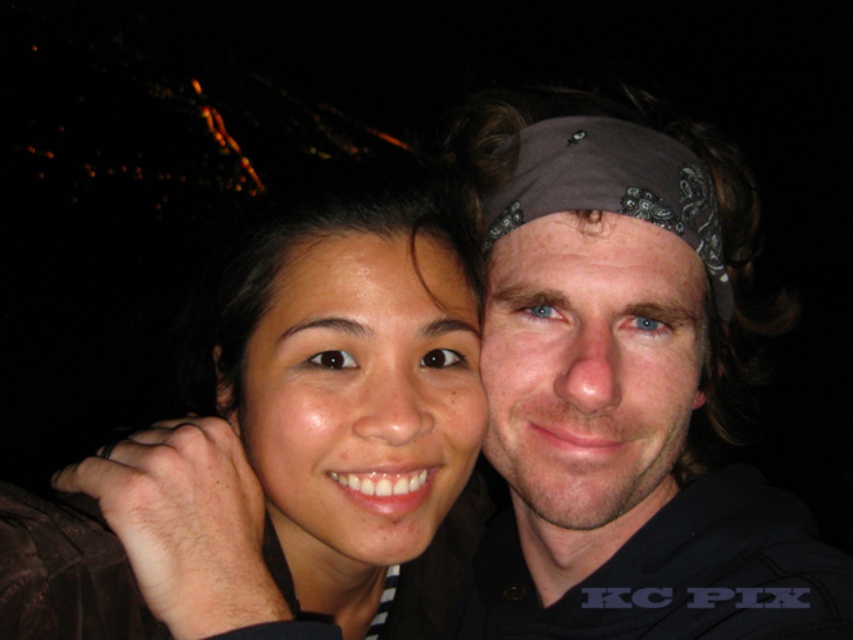
Question: Can you confirm if matte black hair at center is positioned above brown bandana at center?

Choices:
 (A) no
 (B) yes

Answer: (A)

Question: Which of the following is the closest to the observer?

Choices:
 (A) (459, 144)
 (B) (618, 211)

Answer: (B)

Question: Among these points, which one is farthest from the camera?

Choices:
 (A) tap(463, 400)
 (B) tap(718, 307)

Answer: (B)

Question: Where is gray bandana at center located in relation to brown bandana at center in the image?

Choices:
 (A) below
 (B) above

Answer: (A)

Question: Considering the real-world distances, which object is farthest from the gray bandana at center?

Choices:
 (A) brown bandana at center
 (B) matte black hair at center

Answer: (B)

Question: Does gray bandana at center have a smaller size compared to brown bandana at center?

Choices:
 (A) no
 (B) yes

Answer: (A)